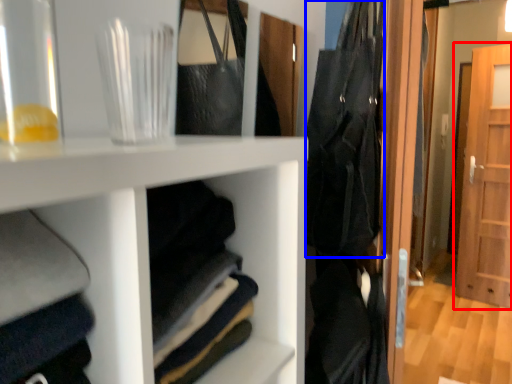
Question: Which object appears farthest to the camera in this image, door (highlighted by a red box) or clothing (highlighted by a blue box)?

Choices:
 (A) door
 (B) clothing

Answer: (A)